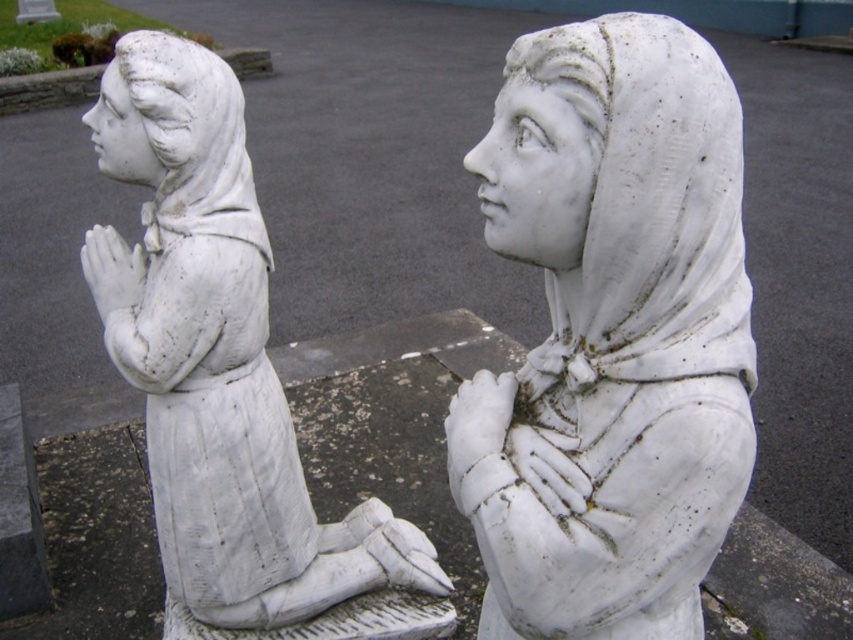
Question: Which point is closer to the camera?

Choices:
 (A) (497, 552)
 (B) (248, 51)
 (C) (184, 220)

Answer: (A)

Question: Estimate the real-world distances between objects in this image. Which object is closer to the white marble statue at upper left?

Choices:
 (A) white marble statue at center
 (B) white marble statue at left

Answer: (B)

Question: Is white marble statue at left above white marble statue at upper left?

Choices:
 (A) no
 (B) yes

Answer: (A)

Question: Does white marble statue at left lie in front of white marble statue at upper left?

Choices:
 (A) yes
 (B) no

Answer: (A)

Question: Can you confirm if white marble statue at center is positioned to the right of white marble statue at left?

Choices:
 (A) yes
 (B) no

Answer: (A)

Question: Which point is closer to the camera?

Choices:
 (A) white marble statue at center
 (B) white marble statue at upper left
 (C) white marble statue at left

Answer: (A)